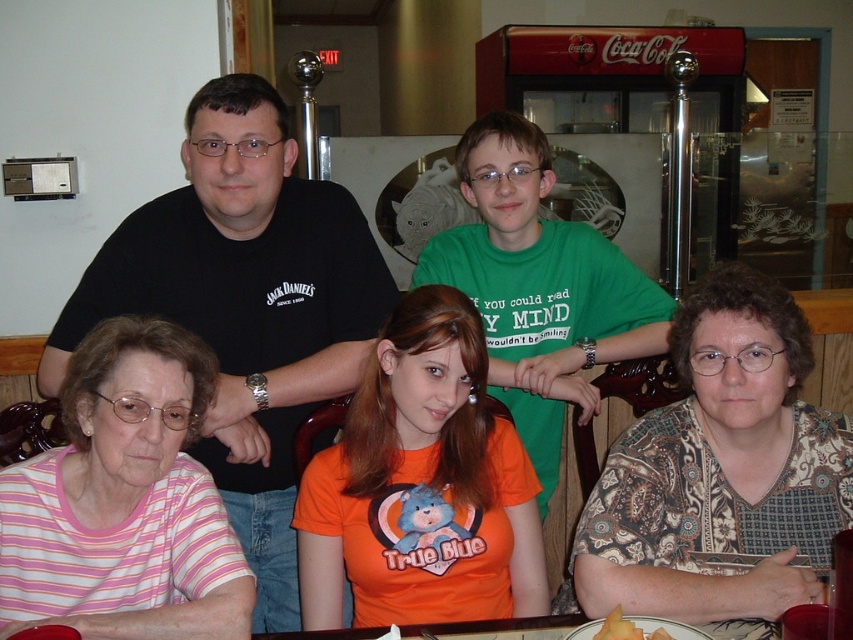
Question: Does green cotton shirt at center have a larger size compared to yellow matte melon at lower center?

Choices:
 (A) no
 (B) yes

Answer: (B)

Question: Is orange matte shirt at center to the left of yellow matte melon at lower center from the viewer's perspective?

Choices:
 (A) yes
 (B) no

Answer: (A)

Question: Which point is farther to the camera?

Choices:
 (A) (728, 525)
 (B) (618, 634)
 (C) (35, 557)
 (D) (331, 525)

Answer: (D)

Question: Among these objects, which one is nearest to the camera?

Choices:
 (A) pink striped shirt at lower left
 (B) green cotton shirt at center
 (C) black t-shirt at upper center
 (D) yellow matte melon at lower center

Answer: (D)

Question: Which point is farther from the camera taking this photo?

Choices:
 (A) (828, 508)
 (B) (456, 484)
 (C) (206, 355)

Answer: (B)

Question: Does black t-shirt at upper center have a larger size compared to pink striped shirt at lower left?

Choices:
 (A) no
 (B) yes

Answer: (B)